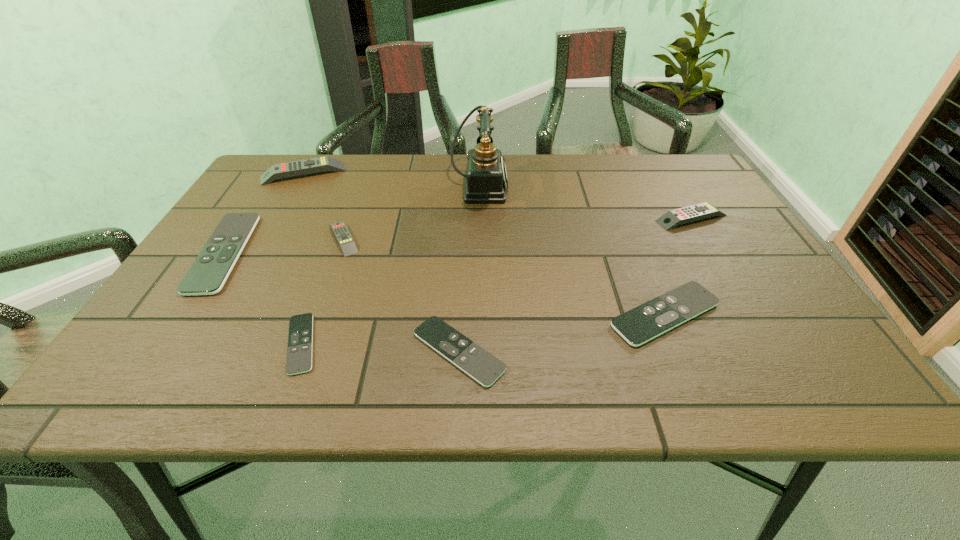
This screenshot has height=540, width=960. I want to click on vacant space that's between the second black remote control from right to left and the farthest remote control, so click(381, 262).

Find the location of `free space between the third shortest object and the farthest remote control`. free space between the third shortest object and the farthest remote control is located at coordinates (484, 244).

You are a GUI agent. You are given a task and a screenshot of the screen. Output one action in this format:
    pyautogui.click(x=<x>, y=<y>)
    Task: Click on the vacant area between the seventh tallest object and the gray telephone
    Image resolution: width=960 pixels, height=540 pixels.
    Given the screenshot: What is the action you would take?
    pyautogui.click(x=469, y=269)

Where is `unoccupied position between the telephone and the second tallest remote control`? The image size is (960, 540). unoccupied position between the telephone and the second tallest remote control is located at coordinates (586, 202).

Locate an element on the screen. object that is the closest to the tallest object is located at coordinates coord(340,230).

Choose which object is the sixth nearest neighbor to the second biggest yellow remote control. Please provide its 2D coordinates. Your answer should be formatted as a tuple, i.e. [(x, y)], where the tuple contains the x and y coordinates of a point satisfying the conditions above.

[(308, 166)]

Identify which remote control is the fifth nearest to the second black remote control from right to left. Please provide its 2D coordinates. Your answer should be formatted as a tuple, i.e. [(x, y)], where the tuple contains the x and y coordinates of a point satisfying the conditions above.

[(672, 218)]

Locate an element on the screen. This screenshot has height=540, width=960. remote control that can be found as the fourth closest to the shortest object is located at coordinates (308, 166).

Locate an element on the screen. The height and width of the screenshot is (540, 960). the closest yellow remote control to the second smallest yellow remote control is located at coordinates (340, 230).

Where is `yellow remote control that is the third closest to the fifth tallest remote control`? The width and height of the screenshot is (960, 540). yellow remote control that is the third closest to the fifth tallest remote control is located at coordinates (308, 166).